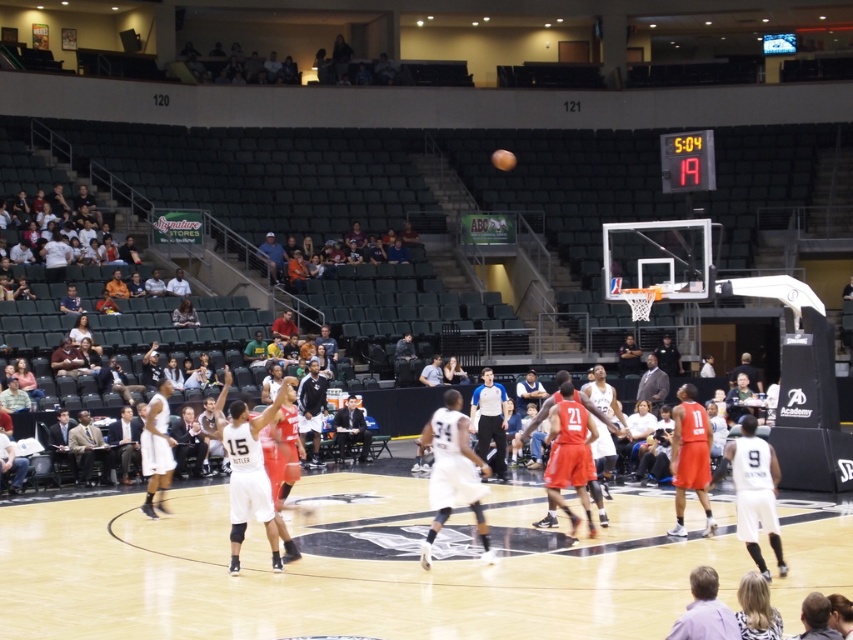
You are a photographer standing at the edge of the basketball court. You want to take a photo of the white matte basketball player at center and the dark gray suit at center. Which one should you zoom in on to capture their full height in the frame?

The white matte basketball player at center is taller than the dark gray suit at center, so you should zoom in on the white matte basketball player at center to ensure their full height is captured in the frame.

You are a spectator at the game and want to know if the wooden polished basketball court at center is wider than the black jersey at center. Based on the scene, can you confirm this?

The wooden polished basketball court at center is wider than the black jersey at center, so yes, the court is wider than the jersey.

You are a spectator sitting in the arena and want to know if the wooden polished basketball court at center is wider than the dark gray suit at center. Can you determine this based on the scene?

The wooden polished basketball court at center might be wider than dark gray suit at center according to the description.